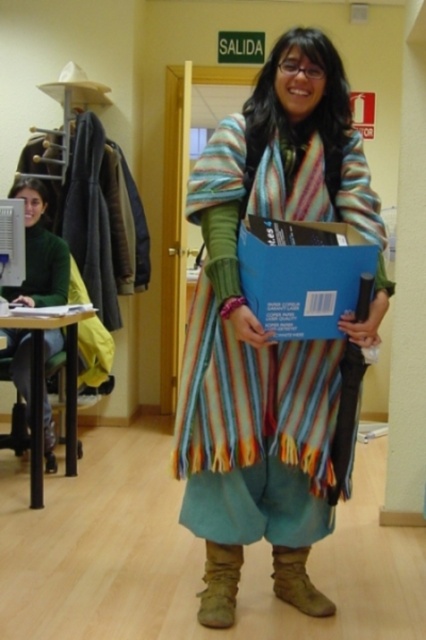
Question: Which point appears farthest from the camera in this image?

Choices:
 (A) (222, 541)
 (B) (51, 332)

Answer: (B)

Question: Does striped woolen poncho at center have a greater width compared to green matte sweater at left?

Choices:
 (A) yes
 (B) no

Answer: (A)

Question: Does striped woolen poncho at center appear on the right side of green matte sweater at left?

Choices:
 (A) no
 (B) yes

Answer: (B)

Question: Which object appears closest to the camera in this image?

Choices:
 (A) green matte sweater at left
 (B) striped woolen poncho at center

Answer: (B)

Question: Is striped woolen poncho at center wider than green matte sweater at left?

Choices:
 (A) no
 (B) yes

Answer: (B)